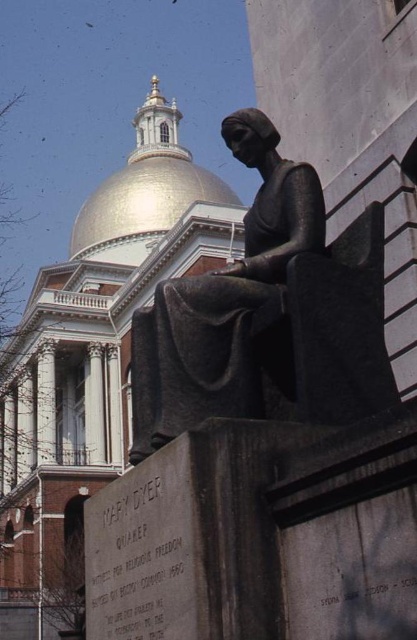
Can you confirm if bronze statue at center is positioned above gold polished dome at upper center?

No.

Does bronze statue at center lie in front of gold polished dome at upper center?

Yes, it is in front of gold polished dome at upper center.

Find the location of `bronze statue at center`. bronze statue at center is located at coordinates (228, 307).